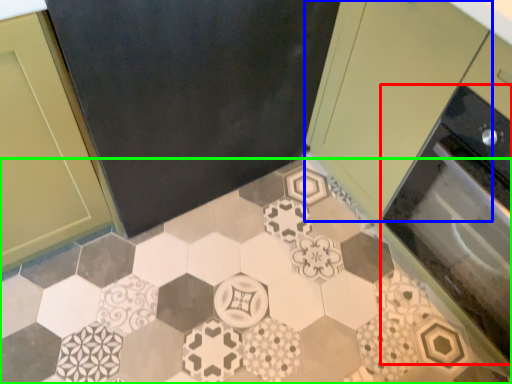
Question: Which is nearer to the oven (highlighted by a red box)? cabinetry (highlighted by a blue box) or ceramic tile (highlighted by a green box).

Choices:
 (A) cabinetry
 (B) ceramic tile

Answer: (A)